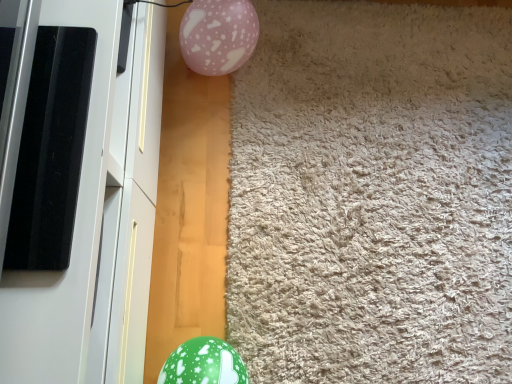
The width and height of the screenshot is (512, 384). In order to click on vacant area to the right of green glossy balloon at lower left in this screenshot , I will do `click(282, 342)`.